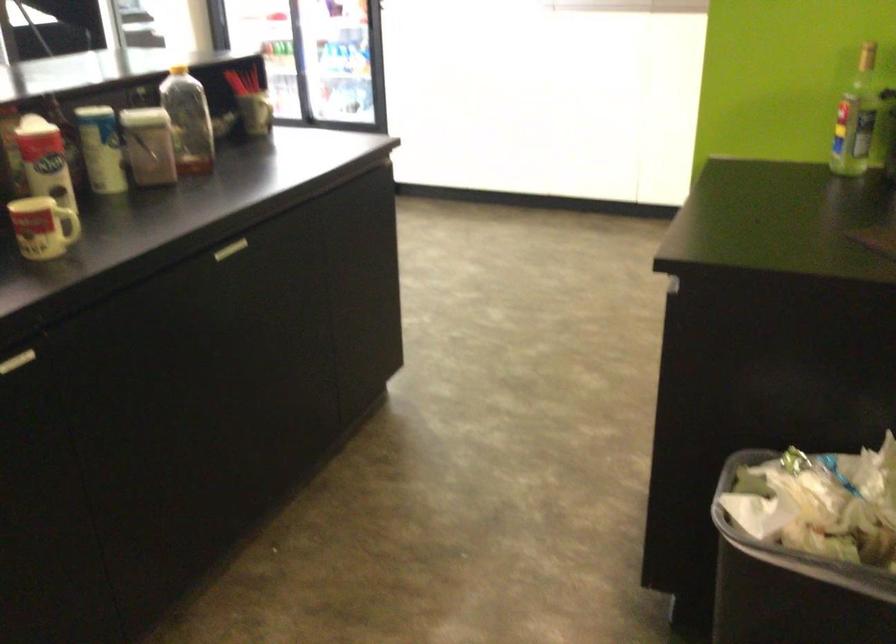
This screenshot has height=644, width=896. Describe the element at coordinates (66, 225) in the screenshot. I see `the yellow mug handle` at that location.